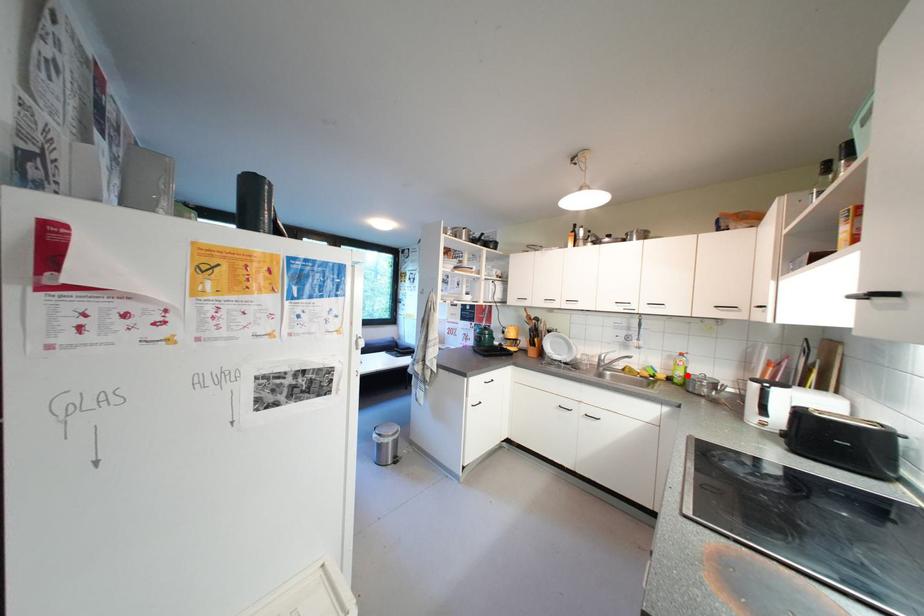
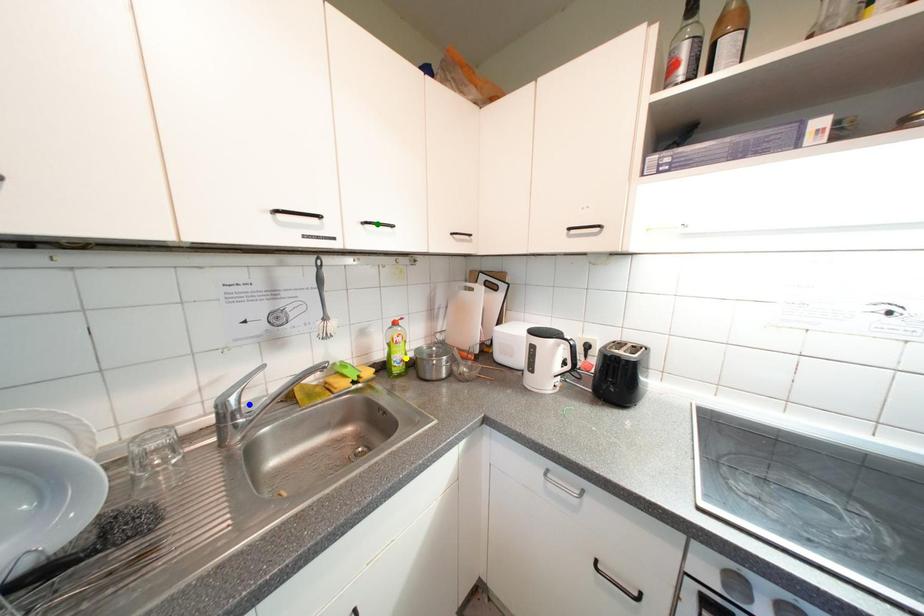
Question: I am providing you with two images of the same scene from different viewpoints. A red point is marked on the first image. You are given multiple points on the second image. Which point in image 2 represents the same 3d spot as the red point in image 1?

Choices:
 (A) blue point
 (B) green point
 (C) yellow point

Answer: (C)